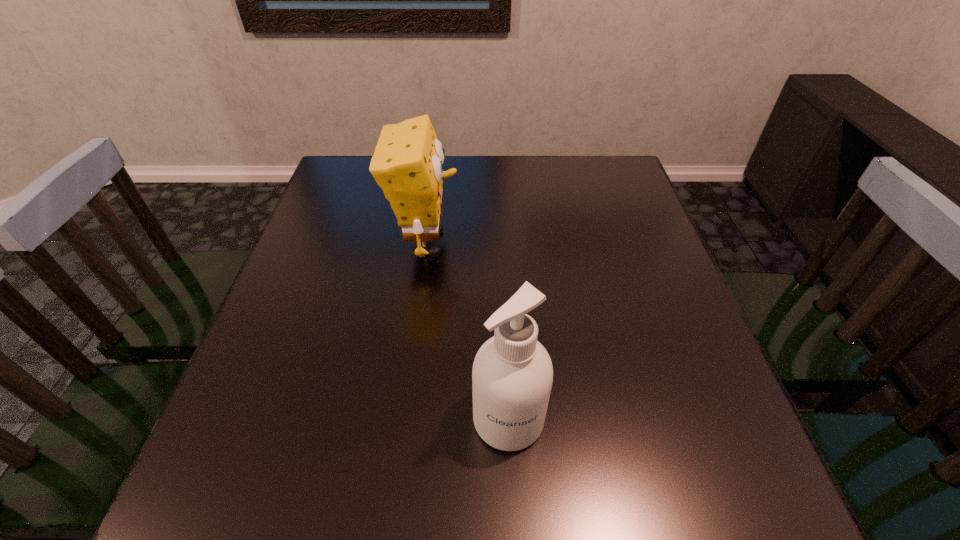
You are a GUI agent. You are given a task and a screenshot of the screen. Output one action in this format:
    pyautogui.click(x=<x>, y=<y>)
    Task: Click on the blank space at the near left corner of the desktop
    Image resolution: width=960 pixels, height=540 pixels.
    Given the screenshot: What is the action you would take?
    [x=243, y=520]